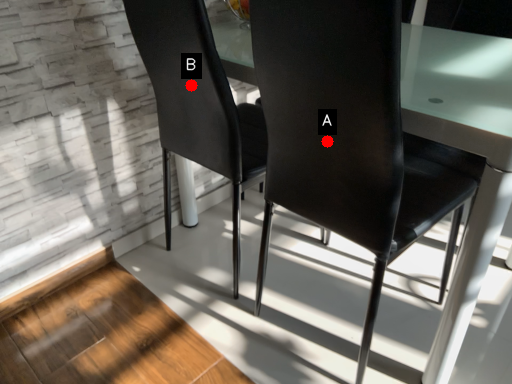
Question: Two points are circled on the image, labeled by A and B beside each circle. Which point is farther to the camera?

Choices:
 (A) A is further
 (B) B is further

Answer: (B)